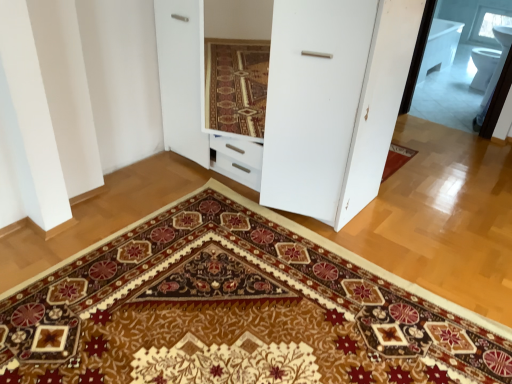
Describe the element at coordinates (337, 107) in the screenshot. Image resolution: width=512 pixels, height=384 pixels. I see `white glossy dresser at center` at that location.

This screenshot has height=384, width=512. Find the location of `white glossy dresser at center`. white glossy dresser at center is located at coordinates (337, 107).

Is white glossy dresser at center spatially inside carpeted mat at center, or outside of it?

white glossy dresser at center cannot be found inside carpeted mat at center.

Considering the points (359, 165) and (281, 231), which point is behind, point (359, 165) or point (281, 231)?

The point (281, 231) is farther from the camera.

Which of these two, white glossy dresser at center or carpeted mat at center, is smaller?

Smaller between the two is carpeted mat at center.

Is white glossy dresser at center facing towards carpeted mat at center?

Yes, white glossy dresser at center faces towards carpeted mat at center.

Measure the distance between carpeted mat at center and transparent glass window at upper right.

carpeted mat at center and transparent glass window at upper right are 4.02 meters apart.

Is carpeted mat at center aimed at transparent glass window at upper right?

No.

Does point (262, 339) appear closer or farther from the camera than point (481, 9)?

Point (262, 339) is closer to the camera than point (481, 9).

Where is `doormat that is in front of the transparent glass window at upper right`? The width and height of the screenshot is (512, 384). doormat that is in front of the transparent glass window at upper right is located at coordinates (232, 312).

Is carpeted mat at center closer to camera compared to white glossy dresser at center?

That is True.

Is carpeted mat at center aimed at white glossy dresser at center?

No, carpeted mat at center is not turned towards white glossy dresser at center.

Is point (307, 352) in front of point (196, 97)?

Yes, it is in front of point (196, 97).

Is there a large distance between carpeted mat at center and white glossy dresser at center?

No, carpeted mat at center is not far away from white glossy dresser at center.

Can we say white glossy dresser at center lies outside transparent glass window at upper right?

white glossy dresser at center lies outside transparent glass window at upper right's area.

Is white glossy dresser at center oriented away from transparent glass window at upper right?

That's right, white glossy dresser at center is facing away from transparent glass window at upper right.

Is there a large distance between white glossy dresser at center and transparent glass window at upper right?

Yes.

From a real-world perspective, does white glossy dresser at center stand above transparent glass window at upper right?

Yes, from a real-world perspective, white glossy dresser at center is above transparent glass window at upper right.

Is the depth of transparent glass window at upper right less than that of carpeted mat at center?

No, the depth of transparent glass window at upper right is greater than that of carpeted mat at center.

From the image's perspective, relative to carpeted mat at center, is transparent glass window at upper right above or below?

transparent glass window at upper right is above carpeted mat at center.

Is point (486, 12) positioned behind point (288, 363)?

Yes, it is.

From a real-world perspective, between transparent glass window at upper right and carpeted mat at center, who is vertically lower?

In real-world perspective, carpeted mat at center is lower.

Which object is positioned more to the left, transparent glass window at upper right or white glossy dresser at center?

Positioned to the left is white glossy dresser at center.

Is transparent glass window at upper right taller than white glossy dresser at center?

Incorrect, the height of transparent glass window at upper right is not larger of that of white glossy dresser at center.

Is white glossy dresser at center at the back of transparent glass window at upper right?

transparent glass window at upper right is not turned away from white glossy dresser at center.

Does point (489, 36) come in front of point (359, 184)?

No.

I want to click on dresser that appears behind the carpeted mat at center, so click(337, 107).

Where is `doormat that is in front of the transparent glass window at upper right`? doormat that is in front of the transparent glass window at upper right is located at coordinates (232, 312).

From the image, which object appears to be nearer to white glossy dresser at center, transparent glass window at upper right or carpeted mat at center?

carpeted mat at center is positioned closer to the anchor white glossy dresser at center.

From the picture: Estimate the real-world distances between objects in this image. Which object is further from transparent glass window at upper right, carpeted mat at center or white glossy dresser at center?

The object further to transparent glass window at upper right is carpeted mat at center.

Estimate the real-world distances between objects in this image. Which object is closer to carpeted mat at center, white glossy dresser at center or transparent glass window at upper right?

white glossy dresser at center is closer to carpeted mat at center.

Considering their positions, is transparent glass window at upper right positioned further to carpeted mat at center than white glossy dresser at center?

transparent glass window at upper right.

Which object lies nearer to the anchor point transparent glass window at upper right, white glossy dresser at center or carpeted mat at center?

white glossy dresser at center is positioned closer to the anchor transparent glass window at upper right.

Based on their spatial positions, is carpeted mat at center or transparent glass window at upper right further from white glossy dresser at center?

transparent glass window at upper right lies further to white glossy dresser at center than the other object.

You are a GUI agent. You are given a task and a screenshot of the screen. Output one action in this format:
    pyautogui.click(x=<x>, y=<y>)
    Task: Click on the dresser between carpeted mat at center and transparent glass window at upper right from front to back
    The image size is (512, 384).
    Given the screenshot: What is the action you would take?
    pyautogui.click(x=337, y=107)